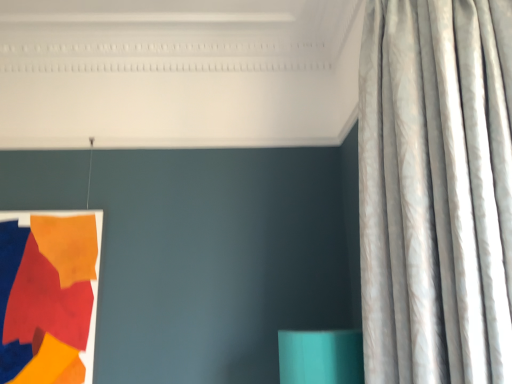
Identify the location of silvery textured curtain at right. (436, 191).

The width and height of the screenshot is (512, 384). Describe the element at coordinates (436, 191) in the screenshot. I see `silvery textured curtain at right` at that location.

What is the approximate width of silvery textured curtain at right?

silvery textured curtain at right is 17.72 inches in width.

The image size is (512, 384). Identify the location of matte fabric tapestry at left. [x=48, y=295].

The image size is (512, 384). Describe the element at coordinates (48, 295) in the screenshot. I see `matte fabric tapestry at left` at that location.

The height and width of the screenshot is (384, 512). I want to click on silvery textured curtain at right, so click(x=436, y=191).

Which is more to the right, matte fabric tapestry at left or silvery textured curtain at right?

From the viewer's perspective, silvery textured curtain at right appears more on the right side.

Does matte fabric tapestry at left come in front of silvery textured curtain at right?

No, matte fabric tapestry at left is further to the viewer.

Does point (24, 234) appear closer or farther from the camera than point (464, 328)?

Point (24, 234) is positioned farther from the camera compared to point (464, 328).

Based on the photo, from the image's perspective, between matte fabric tapestry at left and silvery textured curtain at right, who is located below?

From the image's view, matte fabric tapestry at left is below.

From a real-world perspective, who is located lower, matte fabric tapestry at left or silvery textured curtain at right?

From a 3D spatial view, matte fabric tapestry at left is below.

Is matte fabric tapestry at left wider or thinner than silvery textured curtain at right?

matte fabric tapestry at left is thinner than silvery textured curtain at right.

Between matte fabric tapestry at left and silvery textured curtain at right, which one has less height?

matte fabric tapestry at left is shorter.

Can you confirm if matte fabric tapestry at left is smaller than silvery textured curtain at right?

Yes.

Can we say matte fabric tapestry at left lies outside silvery textured curtain at right?

Absolutely, matte fabric tapestry at left is external to silvery textured curtain at right.

Is there a large distance between matte fabric tapestry at left and silvery textured curtain at right?

Yes, matte fabric tapestry at left is far from silvery textured curtain at right.

Is matte fabric tapestry at left turned away from silvery textured curtain at right?

No, matte fabric tapestry at left's orientation is not away from silvery textured curtain at right.

Measure the distance from matte fabric tapestry at left to silvery textured curtain at right.

They are 1.68 meters apart.

The height and width of the screenshot is (384, 512). Find the location of `curtain located above the matte fabric tapestry at left (from the image's perspective)`. curtain located above the matte fabric tapestry at left (from the image's perspective) is located at coordinates (436, 191).

Is silvery textured curtain at right at the left side of matte fabric tapestry at left?

No.

Is the position of silvery textured curtain at right more distant than that of matte fabric tapestry at left?

No, silvery textured curtain at right is in front of matte fabric tapestry at left.

Considering the points (497, 146) and (81, 364), which point is behind, point (497, 146) or point (81, 364)?

Positioned behind is point (81, 364).

From the image's perspective, is silvery textured curtain at right located above or below matte fabric tapestry at left?

silvery textured curtain at right is situated higher than matte fabric tapestry at left in the image.

From a real-world perspective, is silvery textured curtain at right over matte fabric tapestry at left?

Indeed, from a real-world perspective, silvery textured curtain at right stands above matte fabric tapestry at left.

In terms of width, does silvery textured curtain at right look wider or thinner when compared to matte fabric tapestry at left?

Clearly, silvery textured curtain at right has more width compared to matte fabric tapestry at left.

In the scene shown: Which of these two, silvery textured curtain at right or matte fabric tapestry at left, stands taller?

silvery textured curtain at right is taller.

Between silvery textured curtain at right and matte fabric tapestry at left, which one has smaller size?

Smaller between the two is matte fabric tapestry at left.

Is silvery textured curtain at right spatially inside matte fabric tapestry at left, or outside of it?

The correct answer is: outside.

Is silvery textured curtain at right directly adjacent to matte fabric tapestry at left?

No, silvery textured curtain at right is not next to matte fabric tapestry at left.

Could you tell me if silvery textured curtain at right is turned towards matte fabric tapestry at left?

No, silvery textured curtain at right is not turned towards matte fabric tapestry at left.

Can you tell me how much silvery textured curtain at right and matte fabric tapestry at left differ in facing direction?

They differ by 49.4 degrees in their facing directions.

Measure the distance from silvery textured curtain at right to matte fabric tapestry at left.

silvery textured curtain at right is 1.68 meters from matte fabric tapestry at left.

Where is `tapestry that is under the silvery textured curtain at right (from a real-world perspective)`? The height and width of the screenshot is (384, 512). tapestry that is under the silvery textured curtain at right (from a real-world perspective) is located at coordinates (48, 295).

Find the location of a particular element. Image resolution: width=512 pixels, height=384 pixels. tapestry that is behind the silvery textured curtain at right is located at coordinates (48, 295).

You are a GUI agent. You are given a task and a screenshot of the screen. Output one action in this format:
    pyautogui.click(x=<x>, y=<y>)
    Task: Click on the tapestry below the silvery textured curtain at right (from a real-world perspective)
    
    Given the screenshot: What is the action you would take?
    pyautogui.click(x=48, y=295)